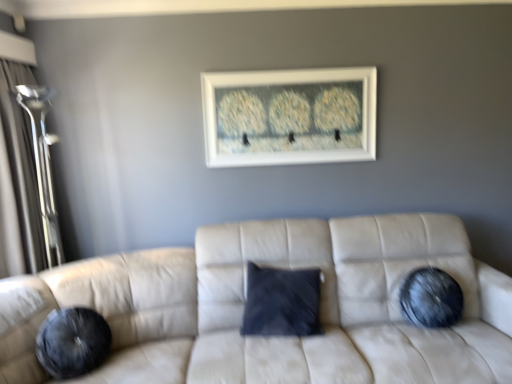
Question: Considering the relative positions of transparent glass door at left and suede beige couch at center in the image provided, is transparent glass door at left in front of suede beige couch at center?

Choices:
 (A) no
 (B) yes

Answer: (A)

Question: From the image's perspective, is transparent glass door at left above suede beige couch at center?

Choices:
 (A) no
 (B) yes

Answer: (B)

Question: Considering the relative sizes of transparent glass door at left and suede beige couch at center in the image provided, is transparent glass door at left bigger than suede beige couch at center?

Choices:
 (A) no
 (B) yes

Answer: (A)

Question: Is transparent glass door at left not close to suede beige couch at center?

Choices:
 (A) yes
 (B) no

Answer: (A)

Question: Is suede beige couch at center surrounded by transparent glass door at left?

Choices:
 (A) yes
 (B) no

Answer: (B)

Question: Is transparent glass door at left to the left or to the right of white matte picture frame at upper center in the image?

Choices:
 (A) left
 (B) right

Answer: (A)

Question: Is transparent glass door at left bigger or smaller than white matte picture frame at upper center?

Choices:
 (A) big
 (B) small

Answer: (A)

Question: From the image's perspective, is transparent glass door at left located above or below white matte picture frame at upper center?

Choices:
 (A) above
 (B) below

Answer: (B)

Question: From a real-world perspective, is transparent glass door at left positioned above or below white matte picture frame at upper center?

Choices:
 (A) below
 (B) above

Answer: (A)

Question: Is white matte picture frame at upper center wider or thinner than transparent glass door at left?

Choices:
 (A) wide
 (B) thin

Answer: (B)

Question: From a real-world perspective, is white matte picture frame at upper center physically located above or below transparent glass door at left?

Choices:
 (A) below
 (B) above

Answer: (B)

Question: Considering the positions of white matte picture frame at upper center and transparent glass door at left in the image, is white matte picture frame at upper center taller or shorter than transparent glass door at left?

Choices:
 (A) tall
 (B) short

Answer: (B)

Question: Considering the positions of point click(x=344, y=155) and point click(x=2, y=61), is point click(x=344, y=155) closer or farther from the camera than point click(x=2, y=61)?

Choices:
 (A) closer
 (B) farther

Answer: (B)

Question: From a real-world perspective, is transparent glass door at left physically located above or below velvety black pillow at right?

Choices:
 (A) below
 (B) above

Answer: (B)

Question: Is transparent glass door at left inside the boundaries of velvety black pillow at right, or outside?

Choices:
 (A) inside
 (B) outside

Answer: (B)